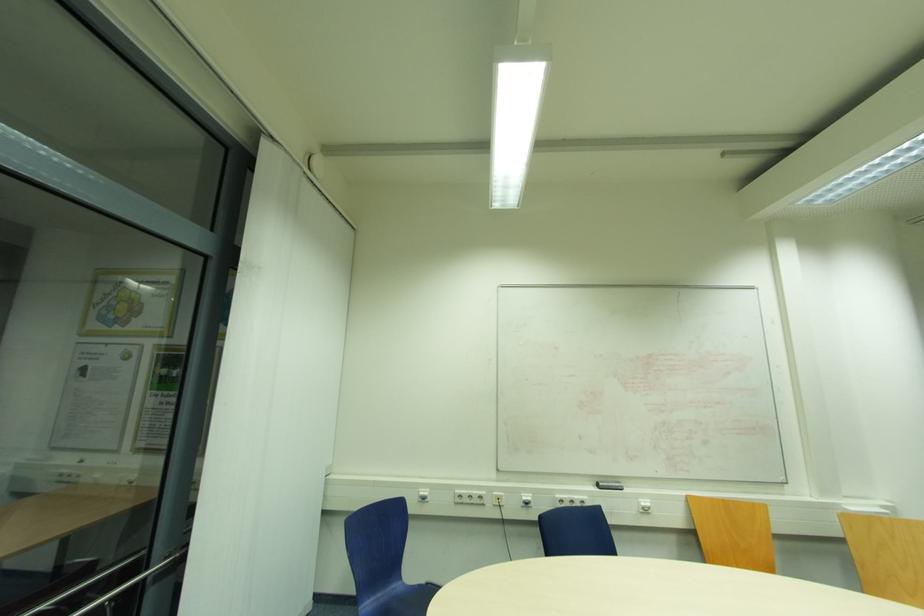
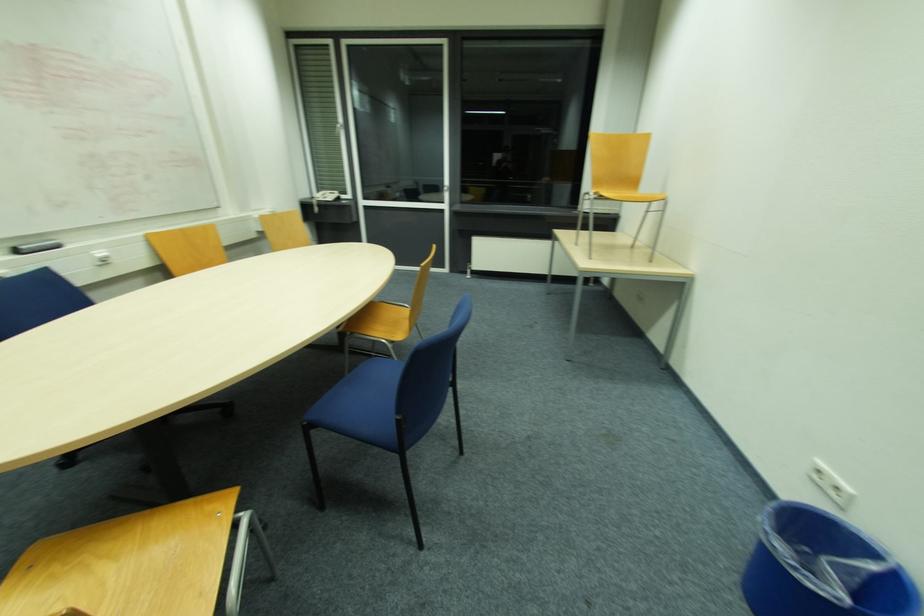
The images are taken continuously from a first-person perspective. In which direction is your viewpoint rotating?

The camera's rotation is toward right-down.